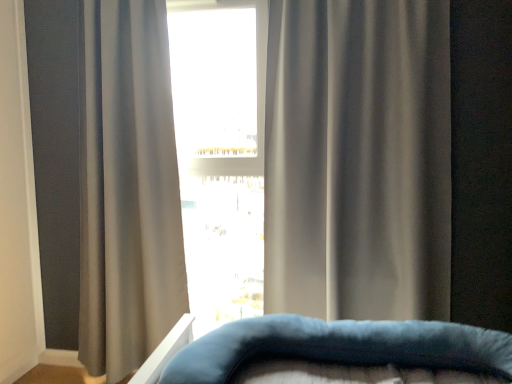
Question: Is white glossy window at center located within gray matte curtain at center, placed as the 1th curtain when sorted from left to right?

Choices:
 (A) no
 (B) yes

Answer: (A)

Question: From a real-world perspective, is gray matte curtain at center, placed as the 1th curtain when sorted from left to right, located higher than white glossy window at center?

Choices:
 (A) yes
 (B) no

Answer: (B)

Question: From the image's perspective, would you say gray matte curtain at center, the 2th curtain viewed from the right, is shown under white glossy window at center?

Choices:
 (A) no
 (B) yes

Answer: (B)

Question: Can you confirm if gray matte curtain at center, placed as the 1th curtain when sorted from left to right, is taller than white glossy window at center?

Choices:
 (A) no
 (B) yes

Answer: (B)

Question: Is gray matte curtain at center, placed as the 1th curtain when sorted from left to right, oriented away from white glossy window at center?

Choices:
 (A) no
 (B) yes

Answer: (A)

Question: In the image, is gray matte curtain at center, placed as the 1th curtain when sorted from left to right, on the left side or the right side of white glossy window at center?

Choices:
 (A) left
 (B) right

Answer: (A)

Question: Is point (125, 59) positioned closer to the camera than point (250, 173)?

Choices:
 (A) closer
 (B) farther

Answer: (A)

Question: From a real-world perspective, relative to white glossy window at center, is gray matte curtain at center, the 2th curtain viewed from the right, vertically above or below?

Choices:
 (A) above
 (B) below

Answer: (B)

Question: Is gray matte curtain at center, placed as the 1th curtain when sorted from left to right, wider or thinner than white glossy window at center?

Choices:
 (A) thin
 (B) wide

Answer: (B)

Question: From the image's perspective, is velvety blue pillow at center above or below satin gray curtain at center, placed as the first curtain when sorted from right to left?

Choices:
 (A) below
 (B) above

Answer: (A)

Question: Considering the positions of velvety blue pillow at center and satin gray curtain at center, which ranks as the second curtain in left-to-right order, in the image, is velvety blue pillow at center wider or thinner than satin gray curtain at center, which ranks as the second curtain in left-to-right order,?

Choices:
 (A) thin
 (B) wide

Answer: (B)

Question: From a real-world perspective, relative to satin gray curtain at center, placed as the first curtain when sorted from right to left, is velvety blue pillow at center vertically above or below?

Choices:
 (A) above
 (B) below

Answer: (B)

Question: Considering their positions, is velvety blue pillow at center located in front of or behind satin gray curtain at center, placed as the first curtain when sorted from right to left?

Choices:
 (A) front
 (B) behind

Answer: (A)

Question: Is satin gray curtain at center, which ranks as the second curtain in left-to-right order, taller or shorter than velvety blue pillow at center?

Choices:
 (A) short
 (B) tall

Answer: (B)

Question: In the image, is satin gray curtain at center, which ranks as the second curtain in left-to-right order, positioned in front of or behind velvety blue pillow at center?

Choices:
 (A) front
 (B) behind

Answer: (B)